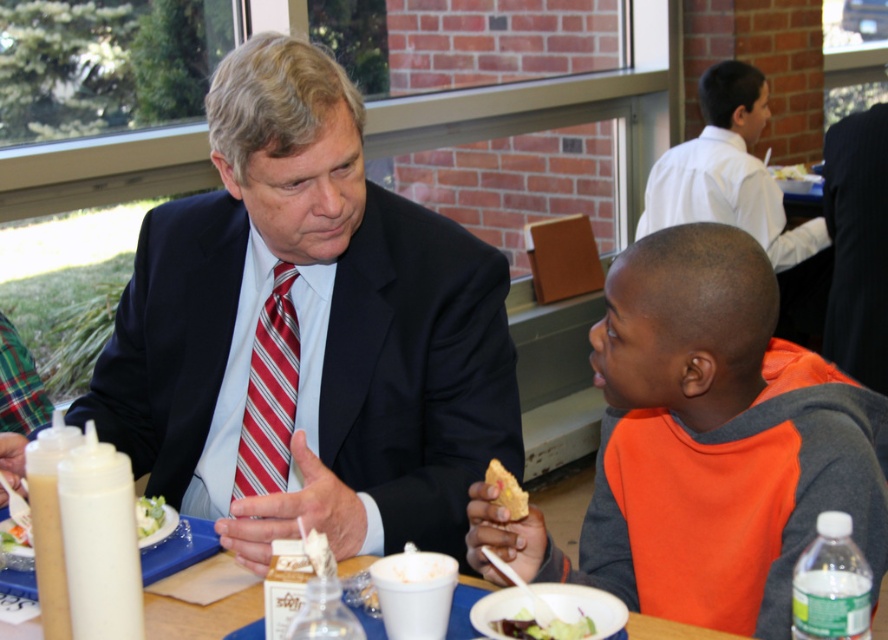
Which is behind, point (123, 428) or point (575, 624)?

Point (123, 428)

Does matte black suit at center have a lesser height compared to green leafy salad at lower center?

Incorrect, matte black suit at center's height does not fall short of green leafy salad at lower center's.

Between point (271, 419) and point (583, 627), which one is positioned in front?

Positioned in front is point (583, 627).

Find the location of a particular element. The height and width of the screenshot is (640, 888). matte black suit at center is located at coordinates (307, 332).

Between matte black suit at center and blue plastic table at center, which one is positioned lower?

blue plastic table at center

Who is more distant from viewer, (398, 212) or (259, 616)?

The point (398, 212) is more distant.

Where is `matte black suit at center`? The width and height of the screenshot is (888, 640). matte black suit at center is located at coordinates (307, 332).

Who is more distant from viewer, (734, 140) or (141, 515)?

Point (734, 140)

The height and width of the screenshot is (640, 888). Identify the location of white shirt at upper right. (727, 172).